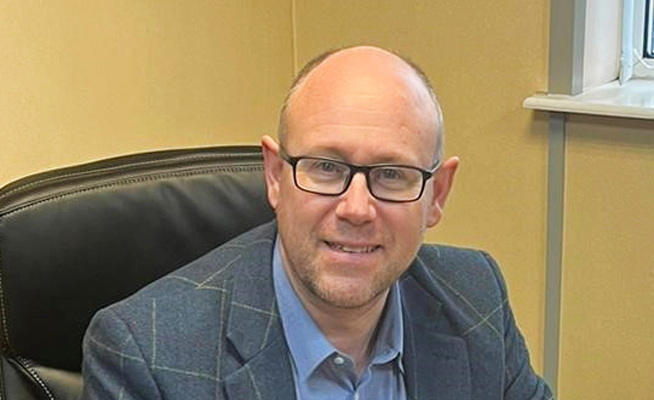
In order to click on corner of white windowsill in this screenshot , I will do `click(526, 105)`.